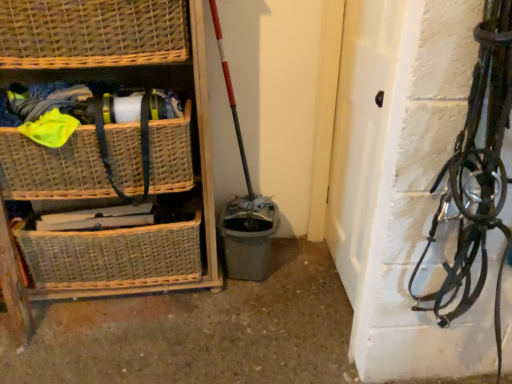
Question: Is woven wicker basket at left closer to the viewer compared to woven wicker basket at lower left, which appears as the first basket when ordered from the bottom?

Choices:
 (A) no
 (B) yes

Answer: (B)

Question: Is woven wicker basket at left facing away from woven wicker basket at lower left, which appears as the first basket when ordered from the bottom?

Choices:
 (A) no
 (B) yes

Answer: (B)

Question: Considering the relative sizes of woven wicker basket at left and woven wicker basket at lower left, which appears as the first basket when ordered from the bottom, in the image provided, is woven wicker basket at left shorter than woven wicker basket at lower left, which appears as the first basket when ordered from the bottom,?

Choices:
 (A) no
 (B) yes

Answer: (A)

Question: From the image's perspective, is woven wicker basket at left beneath woven wicker basket at lower left, which appears as the first basket when ordered from the bottom?

Choices:
 (A) no
 (B) yes

Answer: (A)

Question: Is the position of woven wicker basket at left more distant than that of woven wicker basket at lower left, positioned as the 3th basket in top-to-bottom order?

Choices:
 (A) yes
 (B) no

Answer: (B)

Question: Does woven wicker basket at left have a greater height compared to woven wicker basket at lower left, positioned as the 3th basket in top-to-bottom order?

Choices:
 (A) no
 (B) yes

Answer: (B)

Question: Is woven wicker basket at left wider than woven wicker basket at upper left, the 3th basket from the bottom?

Choices:
 (A) yes
 (B) no

Answer: (A)

Question: Can you confirm if woven wicker basket at left is smaller than woven wicker basket at upper left, placed as the 1th basket when sorted from top to bottom?

Choices:
 (A) no
 (B) yes

Answer: (A)

Question: Considering the relative positions of woven wicker basket at left and woven wicker basket at upper left, the 3th basket from the bottom, in the image provided, is woven wicker basket at left behind woven wicker basket at upper left, the 3th basket from the bottom,?

Choices:
 (A) no
 (B) yes

Answer: (A)

Question: From a real-world perspective, does woven wicker basket at left sit lower than woven wicker basket at upper left, placed as the 1th basket when sorted from top to bottom?

Choices:
 (A) no
 (B) yes

Answer: (B)

Question: From the image's perspective, is woven wicker basket at left above woven wicker basket at upper left, placed as the 1th basket when sorted from top to bottom?

Choices:
 (A) yes
 (B) no

Answer: (B)

Question: Does woven wicker basket at left touch woven wicker basket at upper left, placed as the 1th basket when sorted from top to bottom?

Choices:
 (A) yes
 (B) no

Answer: (B)

Question: Can you confirm if woven wicker basket at lower left, positioned as the 3th basket in top-to-bottom order, is taller than woven wicker basket at left, the second basket from the bottom?

Choices:
 (A) no
 (B) yes

Answer: (B)